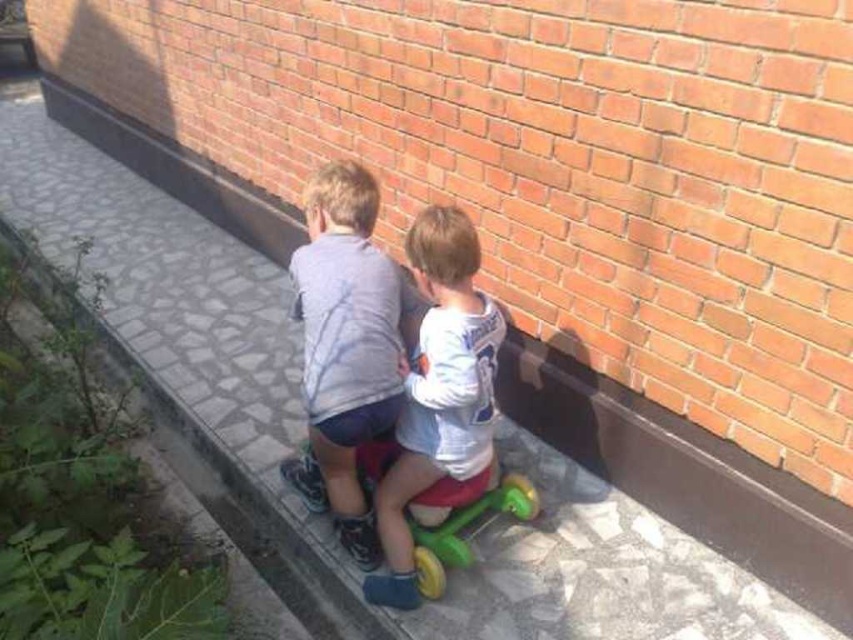
You are a photographer trying to capture both the white matte shirt at center and the green plastic tricycle at lower center in a single shot. Based on their sizes, which object should you focus on to ensure both are clearly visible in the frame?

The white matte shirt at center is bigger than the green plastic tricycle at lower center, so focusing on the white matte shirt at center would help ensure both are clearly visible since it takes up more space in the frame.